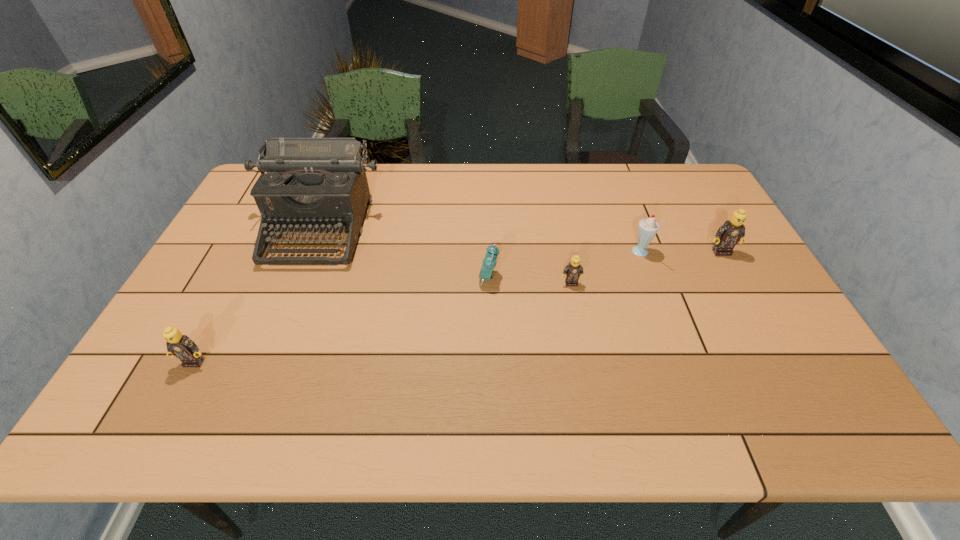
To achieve even spacing by inserting another Lego among them, please point to a vacant spot for this new Lego. Please provide its 2D coordinates. Your answer should be formatted as a tuple, i.e. [(x, y)], where the tuple contains the x and y coordinates of a point satisfying the conditions above.

[(397, 320)]